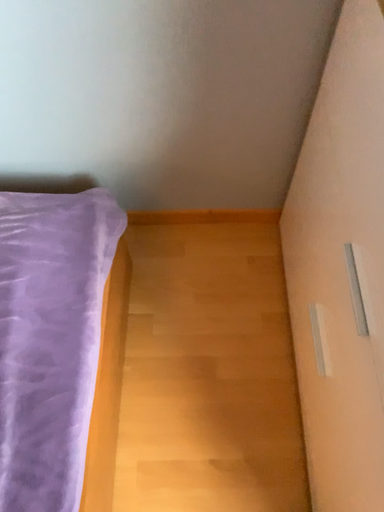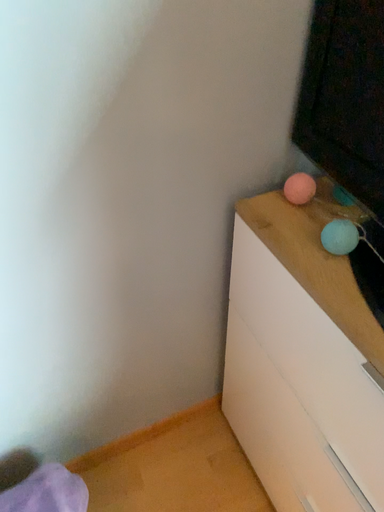
Question: How did the camera likely rotate when shooting the video?

Choices:
 (A) rotated upward
 (B) rotated downward

Answer: (A)